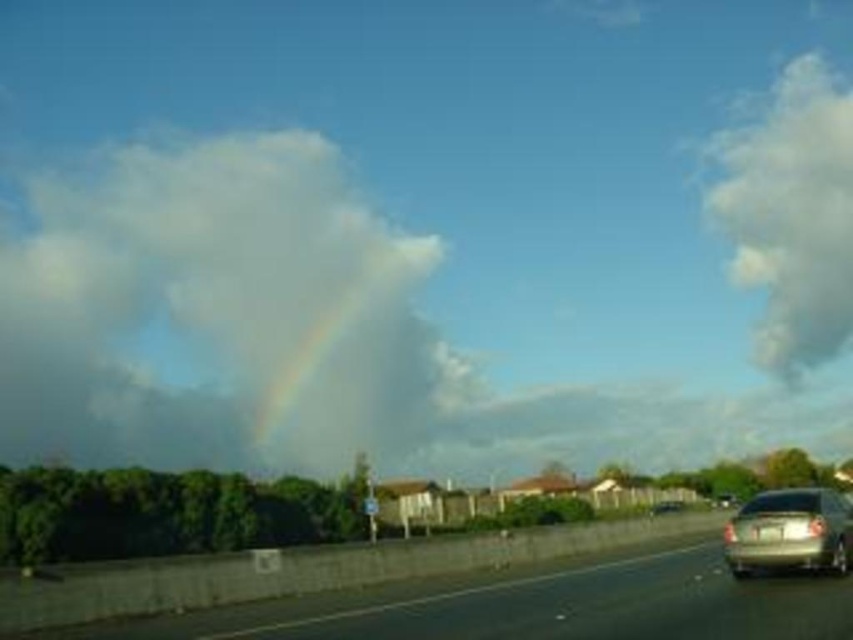
Which is below, white fluffy cloud at upper left or silver metallic car at lower right?

Positioned lower is silver metallic car at lower right.

Who is higher up, white fluffy cloud at upper left or silver metallic car at lower right?

white fluffy cloud at upper left is above.

Between point (260, 220) and point (762, 506), which one is positioned in front?

Positioned in front is point (762, 506).

This screenshot has height=640, width=853. I want to click on white fluffy cloud at upper left, so click(x=218, y=310).

Can you confirm if white fluffy cloud at upper right is positioned below silver metallic car at lower right?

No, white fluffy cloud at upper right is not below silver metallic car at lower right.

Can you confirm if white fluffy cloud at upper right is bigger than silver metallic car at lower right?

Indeed, white fluffy cloud at upper right has a larger size compared to silver metallic car at lower right.

Does point (775, 346) come behind point (767, 554)?

Yes.

Locate an element on the screen. This screenshot has height=640, width=853. white fluffy cloud at upper right is located at coordinates (791, 214).

Is rainbow at center above silver metallic car at lower right?

Indeed, rainbow at center is positioned over silver metallic car at lower right.

I want to click on rainbow at center, so click(x=341, y=333).